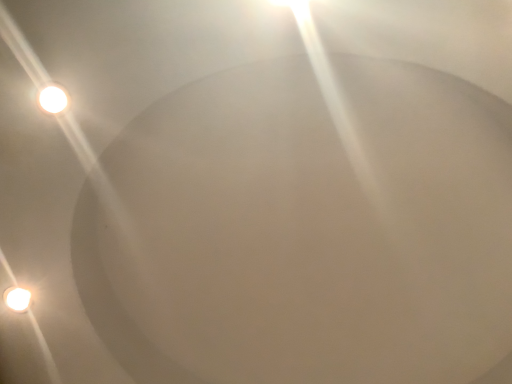
Measure the distance between matte white droplight at upper left and camera.

matte white droplight at upper left is 26.05 inches away from camera.

You are a GUI agent. You are given a task and a screenshot of the screen. Output one action in this format:
    pyautogui.click(x=<x>, y=<y>)
    Task: Click on the matte white droplight at upper left
    
    Given the screenshot: What is the action you would take?
    (x=53, y=98)

Describe the element at coordinates (53, 98) in the screenshot. This screenshot has height=384, width=512. I see `matte white droplight at upper left` at that location.

This screenshot has height=384, width=512. Identify the location of matte white droplight at upper left. (53, 98).